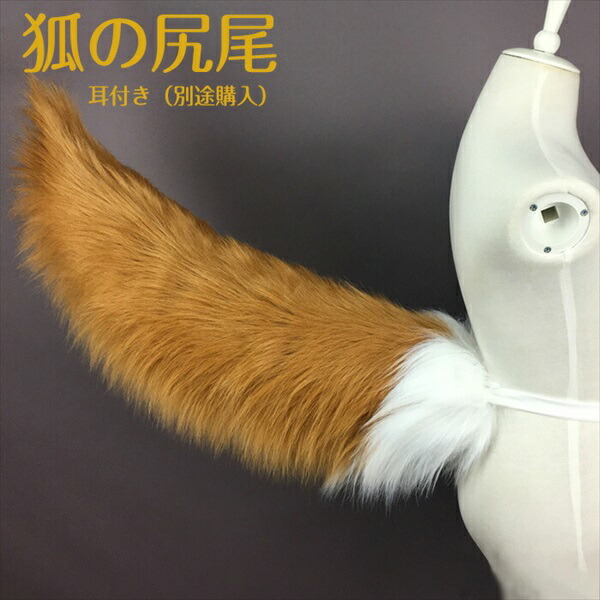
I want to click on screws, so click(x=532, y=210), click(x=585, y=214), click(x=547, y=251).